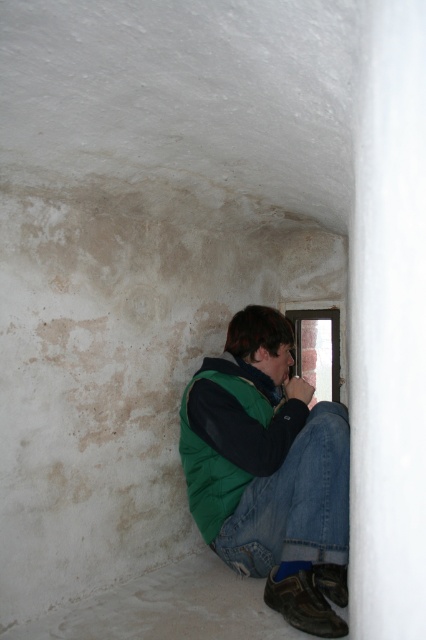
You are standing in the room and want to place a small object at the point closer to you. Which point should you choose between point (x=307, y=529) and point (x=221, y=387)?

Point (x=307, y=529) is closer to the camera than point (x=221, y=387), so you should choose point (x=307, y=529) to place the small object.

You are organizing a clothing donation drive and need to arrange the jeans at lower right and green puffy jacket at lower center in a display. Which clothing item is located to the right of the other?

The jeans at lower right is positioned on the right side of green puffy jacket at lower center.